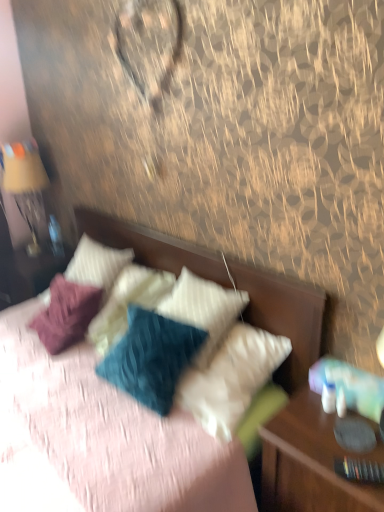
What do you see at coordinates (26, 186) in the screenshot?
I see `matte gold lamp at left` at bounding box center [26, 186].

At what (x,y) coordinates should I click in order to perform the action: click on wooden nightstand at right. Please return your answer as a coordinate pair (x, y). The width and height of the screenshot is (384, 512). Looking at the image, I should click on (311, 462).

This screenshot has height=512, width=384. I want to click on white textured pillow at center, marked as the 1th pillow in a left-to-right arrangement, so click(x=97, y=265).

What do you see at coordinates (203, 310) in the screenshot? The width and height of the screenshot is (384, 512). I see `white textured pillow at upper center, the first pillow from the right` at bounding box center [203, 310].

Locate an element on the screen. The image size is (384, 512). matte gold lamp at left is located at coordinates (26, 186).

Does matte gold lamp at left have a lesser width compared to textured fabric bed at center?

Correct, the width of matte gold lamp at left is less than that of textured fabric bed at center.

Is matte gold lamp at left positioned far away from textured fabric bed at center?

No, there isn't a large distance between matte gold lamp at left and textured fabric bed at center.

Image resolution: width=384 pixels, height=512 pixels. What are the coordinates of `bed lying below the matte gold lamp at left (from the image's perspective)` in the screenshot? It's located at (284, 316).

From the image's perspective, which is below, matte gold lamp at left or textured fabric bed at center?

textured fabric bed at center appears lower in the image.

Can white textured pillow at center, marked as the 1th pillow in a left-to-right arrangement, be found inside textured fabric bed at center?

Indeed, white textured pillow at center, marked as the 1th pillow in a left-to-right arrangement, is located within textured fabric bed at center.

Does textured fabric bed at center have a greater height compared to white textured pillow at center, marked as the 1th pillow in a left-to-right arrangement?

Correct, textured fabric bed at center is much taller as white textured pillow at center, marked as the 1th pillow in a left-to-right arrangement.

How many degrees apart are the facing directions of textured fabric bed at center and white textured pillow at center, which ranks as the 2th pillow in right-to-left order?

4.31 degrees separate the facing orientations of textured fabric bed at center and white textured pillow at center, which ranks as the 2th pillow in right-to-left order.

Where is `pillow that is the 2nd one above the textured fabric bed at center (from a real-world perspective)`? pillow that is the 2nd one above the textured fabric bed at center (from a real-world perspective) is located at coordinates (97, 265).

Based on the photo, from a real-world perspective, which object stands above the other?

From a 3D spatial view, matte gold lamp at left is above.

I want to click on bedside lamp that is behind the textured fabric bed at center, so click(x=26, y=186).

Based on the photo, from the image's perspective, does textured fabric bed at center appear lower than matte gold lamp at left?

Yes, from the image's perspective, textured fabric bed at center is beneath matte gold lamp at left.

Does textured fabric bed at center have a greater width compared to matte gold lamp at left?

Yes.

Between white textured pillow at center, marked as the 1th pillow in a left-to-right arrangement, and matte gold lamp at left, which one has less height?

white textured pillow at center, marked as the 1th pillow in a left-to-right arrangement, is shorter.

From the image's perspective, is white textured pillow at center, marked as the 1th pillow in a left-to-right arrangement, beneath matte gold lamp at left?

Yes.

Is wooden nightstand at right positioned with its back to textured fabric bed at center?

wooden nightstand at right is not turned away from textured fabric bed at center.

Is wooden nightstand at right surrounding textured fabric bed at center?

Definitely not — textured fabric bed at center is not inside wooden nightstand at right.

Considering the relative sizes of wooden nightstand at right and textured fabric bed at center in the image provided, is wooden nightstand at right thinner than textured fabric bed at center?

Yes, wooden nightstand at right is thinner than textured fabric bed at center.

Is wooden nightstand at right to the right of textured fabric bed at center from the viewer's perspective?

Yes, wooden nightstand at right is to the right of textured fabric bed at center.

Considering the positions of points (36, 207) and (301, 445), is point (36, 207) farther from camera compared to point (301, 445)?

Yes, point (36, 207) is farther from viewer.

Which is more to the right, matte gold lamp at left or wooden nightstand at right?

From the viewer's perspective, wooden nightstand at right appears more on the right side.

Considering the relative sizes of matte gold lamp at left and wooden nightstand at right in the image provided, is matte gold lamp at left smaller than wooden nightstand at right?

Yes.

Consider the image. From the image's perspective, which is below, matte gold lamp at left or wooden nightstand at right?

From the image's view, wooden nightstand at right is below.

Can you confirm if white textured pillow at center, marked as the 1th pillow in a left-to-right arrangement, is wider than white textured pillow at upper center, the first pillow from the right?

Yes.

From a real-world perspective, is white textured pillow at center, marked as the 1th pillow in a left-to-right arrangement, above or below white textured pillow at upper center, placed as the 2th pillow when sorted from left to right?

white textured pillow at center, marked as the 1th pillow in a left-to-right arrangement, is above white textured pillow at upper center, placed as the 2th pillow when sorted from left to right.

Which object is further away from the camera, white textured pillow at center, which ranks as the 2th pillow in right-to-left order, or white textured pillow at upper center, the first pillow from the right?

white textured pillow at center, which ranks as the 2th pillow in right-to-left order.

This screenshot has height=512, width=384. In order to click on bedside lamp on the left of textured fabric bed at center in this screenshot , I will do `click(26, 186)`.

You are a GUI agent. You are given a task and a screenshot of the screen. Output one action in this format:
    pyautogui.click(x=<x>, y=<y>)
    Task: Click on the bed located on the right of white textured pillow at center, which ranks as the 2th pillow in right-to-left order
    The image size is (384, 512).
    Given the screenshot: What is the action you would take?
    pyautogui.click(x=284, y=316)

Looking at the image, which one is located further to textured fabric bed at center, white textured pillow at upper center, placed as the 2th pillow when sorted from left to right, or wooden nightstand at right?

wooden nightstand at right lies further to textured fabric bed at center than the other object.

Estimate the real-world distances between objects in this image. Which object is further from matte gold lamp at left, white textured pillow at center, marked as the 1th pillow in a left-to-right arrangement, or textured fabric bed at center?

Based on the image, textured fabric bed at center appears to be further to matte gold lamp at left.

Considering their positions, is white textured pillow at upper center, placed as the 2th pillow when sorted from left to right, positioned further to matte gold lamp at left than white textured pillow at center, marked as the 1th pillow in a left-to-right arrangement?

The object further to matte gold lamp at left is white textured pillow at upper center, placed as the 2th pillow when sorted from left to right.

Looking at the image, which one is located closer to textured fabric bed at center, wooden nightstand at right or white textured pillow at upper center, the first pillow from the right?

white textured pillow at upper center, the first pillow from the right, is positioned closer to the anchor textured fabric bed at center.

From the image, which object appears to be farther from white textured pillow at center, marked as the 1th pillow in a left-to-right arrangement, matte gold lamp at left or textured fabric bed at center?

matte gold lamp at left.

Estimate the real-world distances between objects in this image. Which object is closer to white textured pillow at center, which ranks as the 2th pillow in right-to-left order, wooden nightstand at right or textured fabric bed at center?

Among the two, textured fabric bed at center is located nearer to white textured pillow at center, which ranks as the 2th pillow in right-to-left order.

Consider the image. Based on their spatial positions, is white textured pillow at center, which ranks as the 2th pillow in right-to-left order, or matte gold lamp at left further from white textured pillow at upper center, placed as the 2th pillow when sorted from left to right?

Based on the image, matte gold lamp at left appears to be further to white textured pillow at upper center, placed as the 2th pillow when sorted from left to right.

Which object lies nearer to the anchor point textured fabric bed at center, white textured pillow at center, marked as the 1th pillow in a left-to-right arrangement, or matte gold lamp at left?

white textured pillow at center, marked as the 1th pillow in a left-to-right arrangement, lies closer to textured fabric bed at center than the other object.

Where is `pillow located between white textured pillow at center, marked as the 1th pillow in a left-to-right arrangement, and wooden nightstand at right in the left-right direction`? pillow located between white textured pillow at center, marked as the 1th pillow in a left-to-right arrangement, and wooden nightstand at right in the left-right direction is located at coordinates (203, 310).

Where is `nightstand positioned between textured fabric bed at center and white textured pillow at center, which ranks as the 2th pillow in right-to-left order, from near to far`? The image size is (384, 512). nightstand positioned between textured fabric bed at center and white textured pillow at center, which ranks as the 2th pillow in right-to-left order, from near to far is located at coordinates (311, 462).

Find the location of a particular element. nightstand between textured fabric bed at center and matte gold lamp at left in the front-back direction is located at coordinates point(311,462).

Identify the location of pillow positioned between textured fabric bed at center and white textured pillow at center, which ranks as the 2th pillow in right-to-left order, from near to far. The width and height of the screenshot is (384, 512). (203, 310).